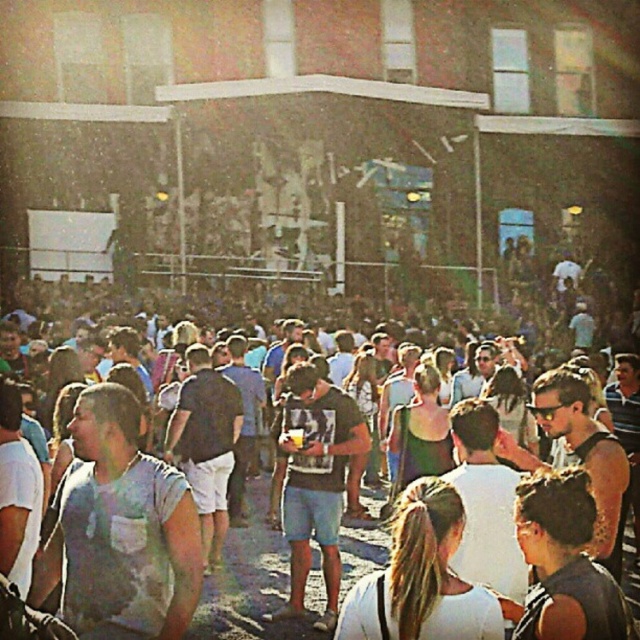
Question: Where is light blue cotton shirt at center located in relation to dark brown t-shirt at center in the image?

Choices:
 (A) left
 (B) right

Answer: (A)

Question: Which object is positioned farthest from the white matte shirt at center?

Choices:
 (A) light blue cotton shirt at center
 (B) light blue denim shorts at center
 (C) dark brown t-shirt at center

Answer: (A)

Question: Does light blue cotton shirt at center have a smaller size compared to light blue denim shorts at center?

Choices:
 (A) yes
 (B) no

Answer: (A)

Question: Observing the image, what is the correct spatial positioning of dark brown t-shirt at center in reference to light blue denim shorts at center?

Choices:
 (A) below
 (B) above

Answer: (A)

Question: Which point is closer to the camera?

Choices:
 (A) (323, 614)
 (B) (400, 502)

Answer: (B)

Question: Which point is closer to the camera?

Choices:
 (A) light blue denim shorts at center
 (B) light blue cotton shirt at center
 (C) white matte shirt at center

Answer: (C)